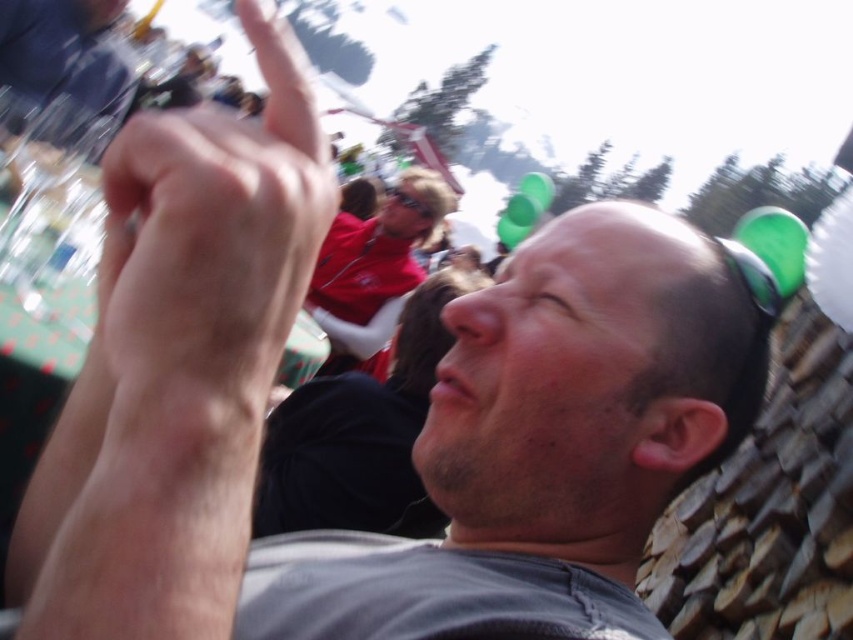
Question: Which point is farther to the camera?

Choices:
 (A) matte red shirt at center
 (B) skinny flesh at upper left

Answer: (A)

Question: Does skinny flesh at upper left have a larger size compared to matte red shirt at center?

Choices:
 (A) no
 (B) yes

Answer: (B)

Question: Is skinny flesh at upper left closer to the viewer compared to matte red shirt at center?

Choices:
 (A) yes
 (B) no

Answer: (A)

Question: Among these objects, which one is farthest from the camera?

Choices:
 (A) matte red shirt at center
 (B) skinny flesh at upper left

Answer: (A)

Question: Is skinny flesh at upper left thinner than matte red shirt at center?

Choices:
 (A) no
 (B) yes

Answer: (A)